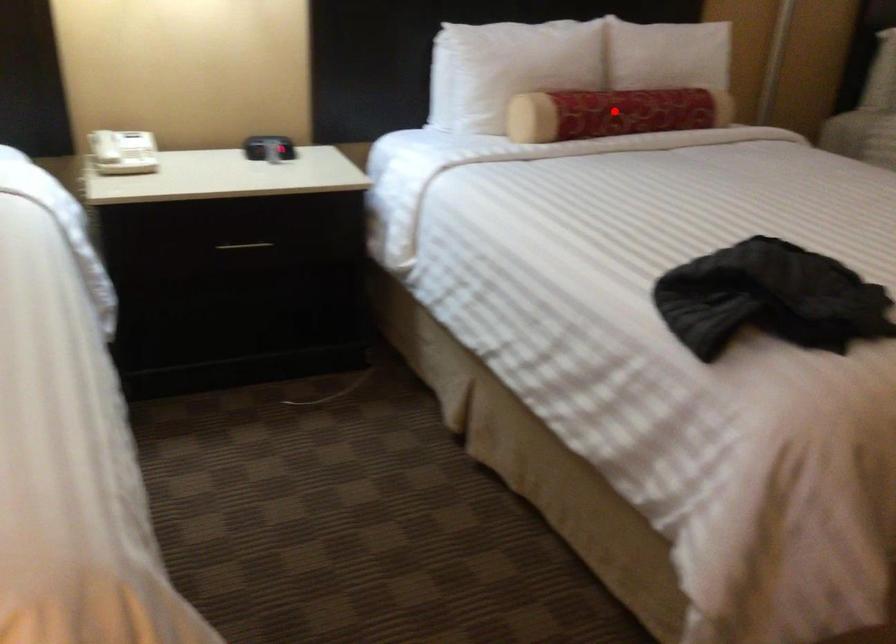
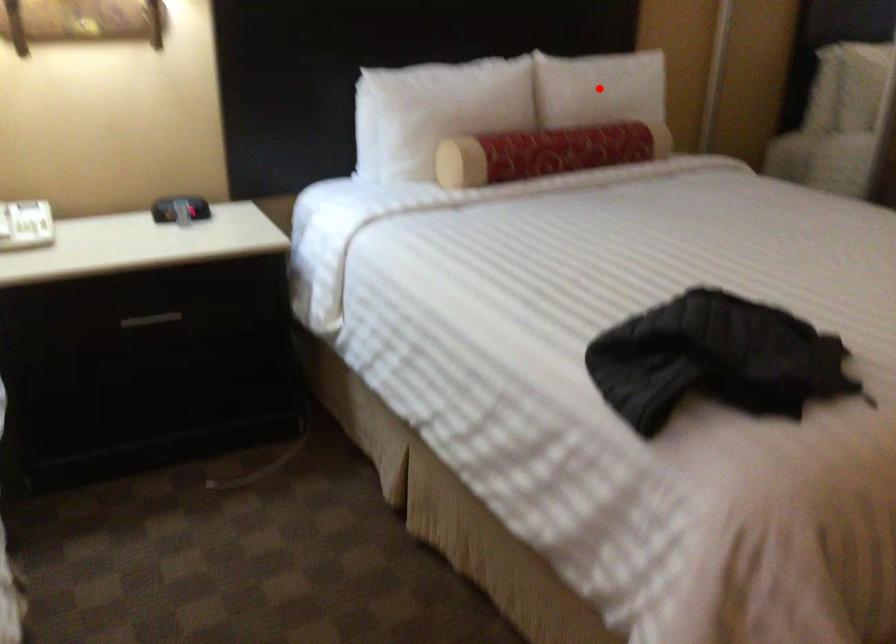
I am providing you with two images of the same scene from different viewpoints. A red point is marked on the first image and another point is marked on the second image. Are the points marked in image1 and image2 representing the same 3D position?

No